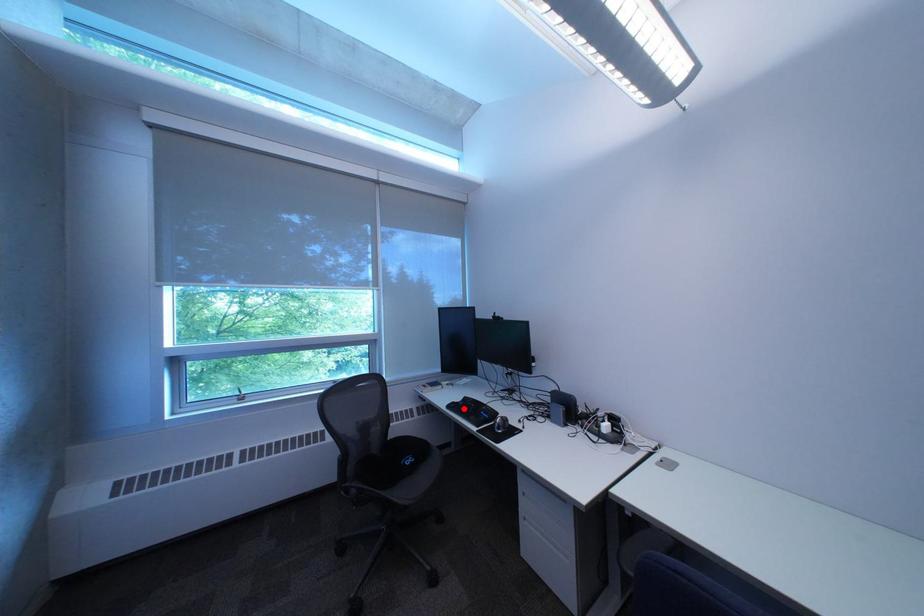
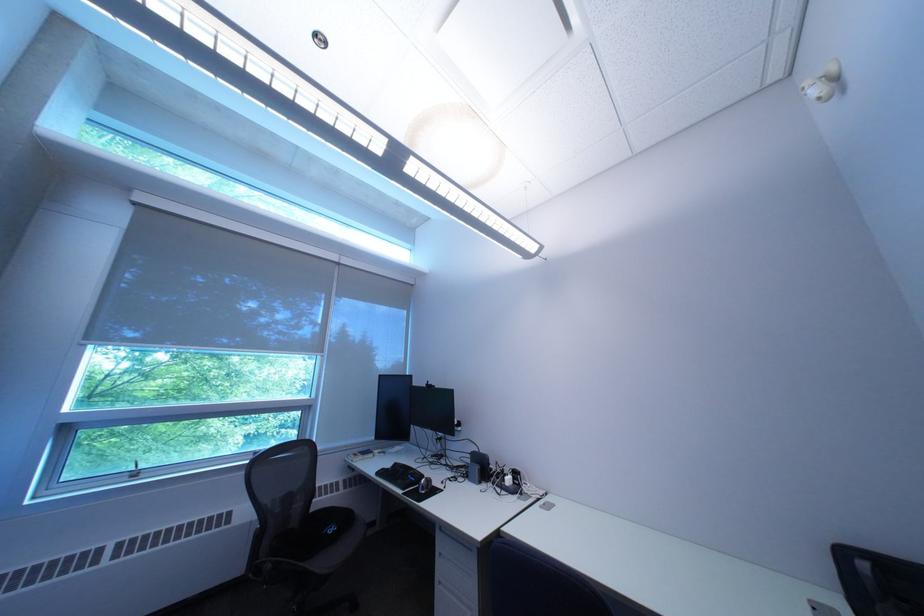
Where in the second image is the point corresponding to the highlighted location from the first image?

(393, 475)